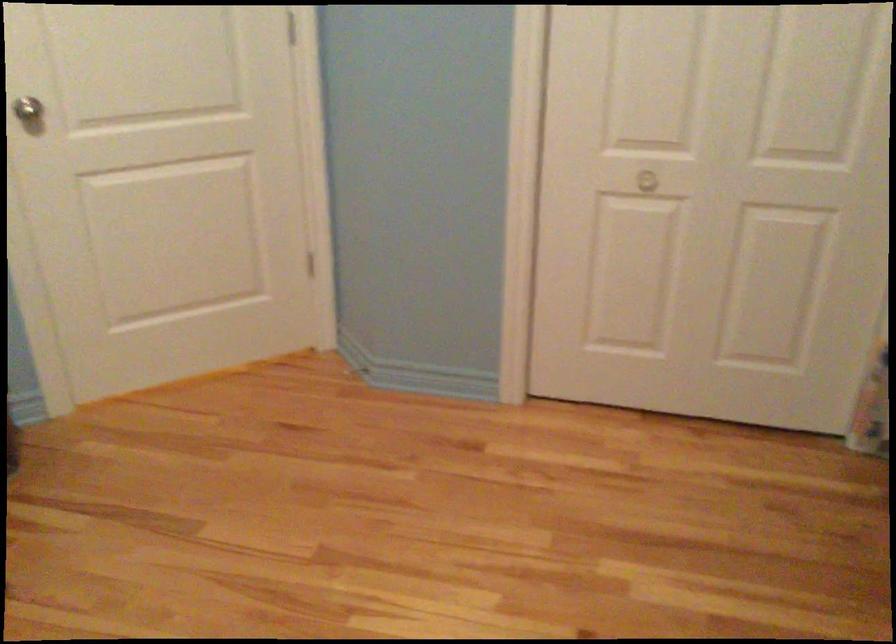
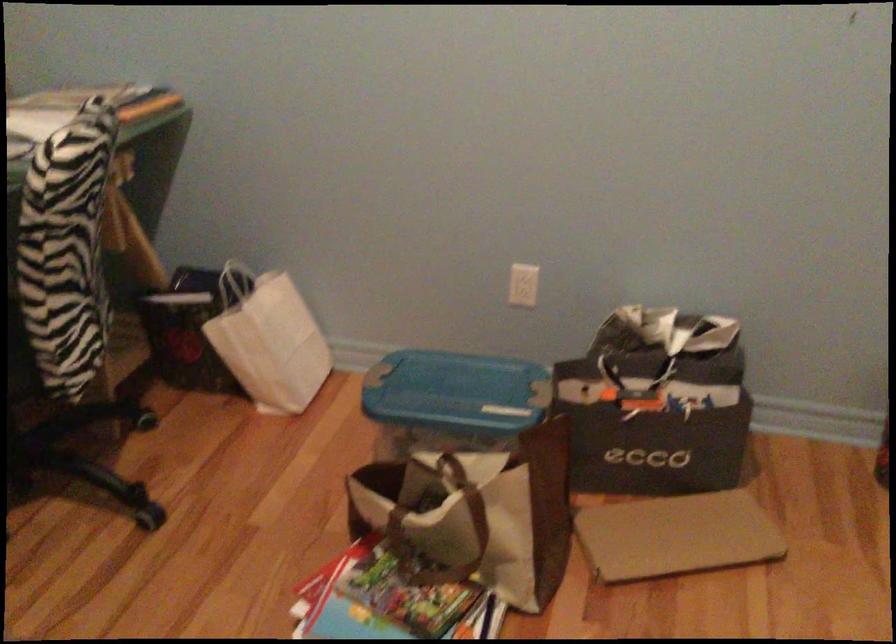
The images are taken continuously from a first-person perspective. In which direction is your viewpoint rotating?

The rotation direction of the camera is left-down.